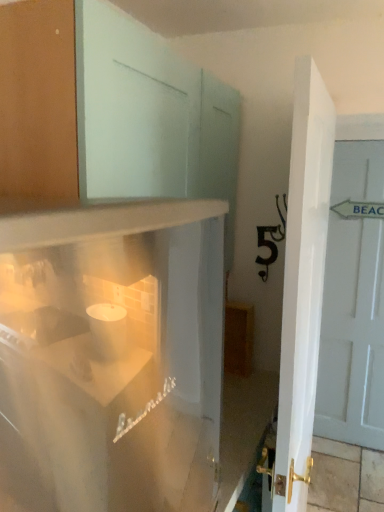
Locate an element on the screen. white painted wood door at right, which is counted as the 1th door, starting from the right is located at coordinates (354, 301).

Find the location of a particular element. white glossy refrigerator at lower left is located at coordinates (121, 297).

Image resolution: width=384 pixels, height=512 pixels. What do you see at coordinates (121, 297) in the screenshot?
I see `white glossy refrigerator at lower left` at bounding box center [121, 297].

The height and width of the screenshot is (512, 384). What are the coordinates of `white glossy door at center, which appears as the second door when viewed from the right` in the screenshot? It's located at (303, 285).

Find the location of a particular element. This screenshot has height=512, width=384. white painted wood door at right, the 2th door from the left is located at coordinates (354, 301).

Looking at this image, which object is thinner, white glossy door at center, which appears as the second door when viewed from the right, or white painted wood door at right, which is counted as the 1th door, starting from the right?

white painted wood door at right, which is counted as the 1th door, starting from the right, is thinner.

From a real-world perspective, relative to white painted wood door at right, the first door positioned from the back, is white glossy door at center, which appears as the second door when viewed from the right, vertically above or below?

Clearly, from a real-world perspective, white glossy door at center, which appears as the second door when viewed from the right, is above white painted wood door at right, the first door positioned from the back.

Where is `door on the right of white glossy door at center, the second door positioned from the back`? The height and width of the screenshot is (512, 384). door on the right of white glossy door at center, the second door positioned from the back is located at coordinates (354, 301).

Would you say white glossy door at center, positioned as the first door in left-to-right order, is to the left or to the right of white painted wood door at right, arranged as the 2th door when viewed from the front, in the picture?

white glossy door at center, positioned as the first door in left-to-right order, is to the left of white painted wood door at right, arranged as the 2th door when viewed from the front.

Which of these two, white glossy door at center, the second door positioned from the back, or white glossy refrigerator at lower left, is thinner?

Thinner between the two is white glossy door at center, the second door positioned from the back.

Does white glossy door at center, positioned as the first door in left-to-right order, appear on the right side of white glossy refrigerator at lower left?

Indeed, white glossy door at center, positioned as the first door in left-to-right order, is positioned on the right side of white glossy refrigerator at lower left.

Is white glossy door at center, which appears as the 1th door when viewed from the front, outside of white glossy refrigerator at lower left?

Indeed, white glossy door at center, which appears as the 1th door when viewed from the front, is completely outside white glossy refrigerator at lower left.

This screenshot has width=384, height=512. In the image, there is a white glossy refrigerator at lower left. In order to click on door above it (from the image's perspective) in this screenshot , I will do `click(354, 301)`.

Does white glossy refrigerator at lower left come behind white painted wood door at right, the 2th door from the left?

That is False.

From a real-world perspective, who is located lower, white glossy refrigerator at lower left or white painted wood door at right, which is counted as the 1th door, starting from the right?

white painted wood door at right, which is counted as the 1th door, starting from the right, is physically lower.

Which point is more distant from viewer, (202, 469) or (349, 186)?

The point (349, 186) is farther from the camera.

Between point (199, 295) and point (319, 288), which one is positioned behind?

Point (199, 295)

Can you confirm if white glossy refrigerator at lower left is taller than white glossy door at center, positioned as the first door in left-to-right order?

No.

Is white glossy refrigerator at lower left positioned beyond the bounds of white glossy door at center, the second door positioned from the back?

white glossy refrigerator at lower left is positioned outside white glossy door at center, the second door positioned from the back.

From the image's perspective, between white glossy refrigerator at lower left and white glossy door at center, the second door positioned from the back, which one is located above?

white glossy refrigerator at lower left is shown above in the image.

Are white painted wood door at right, the 2th door from the left, and white glossy door at center, the second door positioned from the back, located far from each other?

Yes, white painted wood door at right, the 2th door from the left, and white glossy door at center, the second door positioned from the back, are quite far apart.

Based on the photo, who is smaller, white painted wood door at right, arranged as the 2th door when viewed from the front, or white glossy door at center, positioned as the first door in left-to-right order?

white painted wood door at right, arranged as the 2th door when viewed from the front.

Is white painted wood door at right, which is counted as the 1th door, starting from the right, aimed at white glossy door at center, which appears as the 1th door when viewed from the front?

Yes.

From a real-world perspective, who is located lower, white painted wood door at right, arranged as the 2th door when viewed from the front, or white glossy door at center, which appears as the second door when viewed from the right?

From a 3D spatial view, white painted wood door at right, arranged as the 2th door when viewed from the front, is below.

Between white painted wood door at right, the 2th door from the left, and white glossy refrigerator at lower left, which one has larger width?

Wider between the two is white glossy refrigerator at lower left.

From the image's perspective, relative to white glossy refrigerator at lower left, is white painted wood door at right, the first door positioned from the back, above or below?

From the image's perspective, white painted wood door at right, the first door positioned from the back, appears above white glossy refrigerator at lower left.

In terms of height, does white painted wood door at right, arranged as the 2th door when viewed from the front, look taller or shorter compared to white glossy refrigerator at lower left?

Clearly, white painted wood door at right, arranged as the 2th door when viewed from the front, is taller compared to white glossy refrigerator at lower left.

Measure the distance between white painted wood door at right, the 2th door from the left, and white glossy refrigerator at lower left.

white painted wood door at right, the 2th door from the left, and white glossy refrigerator at lower left are 1.45 meters apart.

The image size is (384, 512). Find the location of `door on the left of white painted wood door at right, which is counted as the 1th door, starting from the right`. door on the left of white painted wood door at right, which is counted as the 1th door, starting from the right is located at coordinates (303, 285).

Locate an element on the screen. The width and height of the screenshot is (384, 512). cabinetry above the white glossy door at center, positioned as the first door in left-to-right order (from a real-world perspective) is located at coordinates tap(121, 297).

Which object lies further to the anchor point white painted wood door at right, which is counted as the 1th door, starting from the right, white glossy refrigerator at lower left or white glossy door at center, which appears as the second door when viewed from the right?

The object further to white painted wood door at right, which is counted as the 1th door, starting from the right, is white glossy door at center, which appears as the second door when viewed from the right.

Which object lies nearer to the anchor point white glossy door at center, positioned as the first door in left-to-right order, white glossy refrigerator at lower left or white painted wood door at right, which is counted as the 1th door, starting from the right?

The object closer to white glossy door at center, positioned as the first door in left-to-right order, is white glossy refrigerator at lower left.

Based on the photo, looking at the image, which one is located closer to white glossy refrigerator at lower left, white painted wood door at right, the 2th door from the left, or white glossy door at center, the second door positioned from the back?

white glossy door at center, the second door positioned from the back, is positioned closer to the anchor white glossy refrigerator at lower left.

Considering their positions, is white painted wood door at right, which is counted as the 1th door, starting from the right, positioned further to white glossy door at center, which appears as the second door when viewed from the right, than white glossy refrigerator at lower left?

white painted wood door at right, which is counted as the 1th door, starting from the right, lies further to white glossy door at center, which appears as the second door when viewed from the right, than the other object.

Consider the image. Looking at the image, which one is located closer to white glossy refrigerator at lower left, white glossy door at center, positioned as the first door in left-to-right order, or white painted wood door at right, which is counted as the 1th door, starting from the right?

The object closer to white glossy refrigerator at lower left is white glossy door at center, positioned as the first door in left-to-right order.

Which object lies further to the anchor point white painted wood door at right, arranged as the 2th door when viewed from the front, white glossy door at center, which appears as the 1th door when viewed from the front, or white glossy refrigerator at lower left?

Among the two, white glossy door at center, which appears as the 1th door when viewed from the front, is located further to white painted wood door at right, arranged as the 2th door when viewed from the front.

Identify the location of door between white glossy refrigerator at lower left and white painted wood door at right, the first door positioned from the back, in the front-back direction. (303, 285).